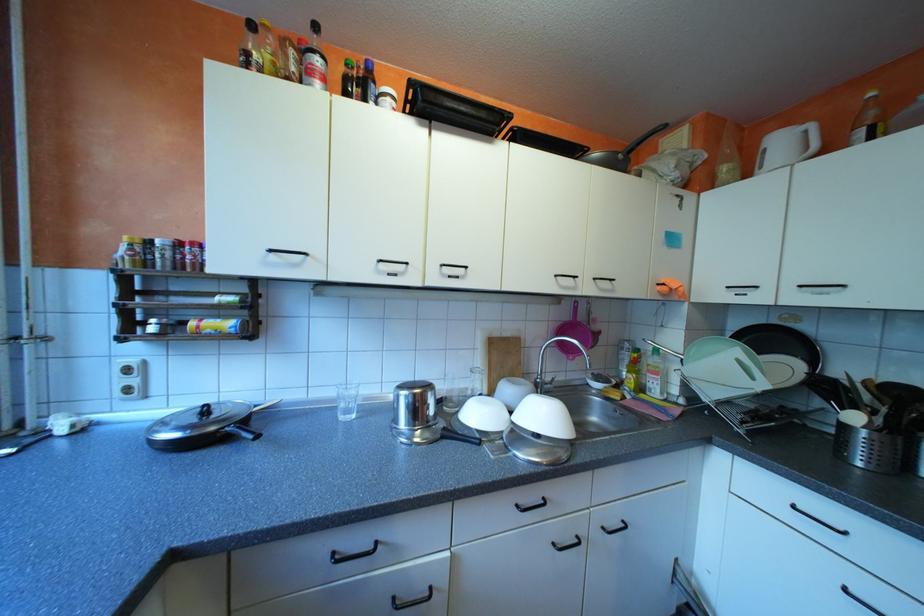
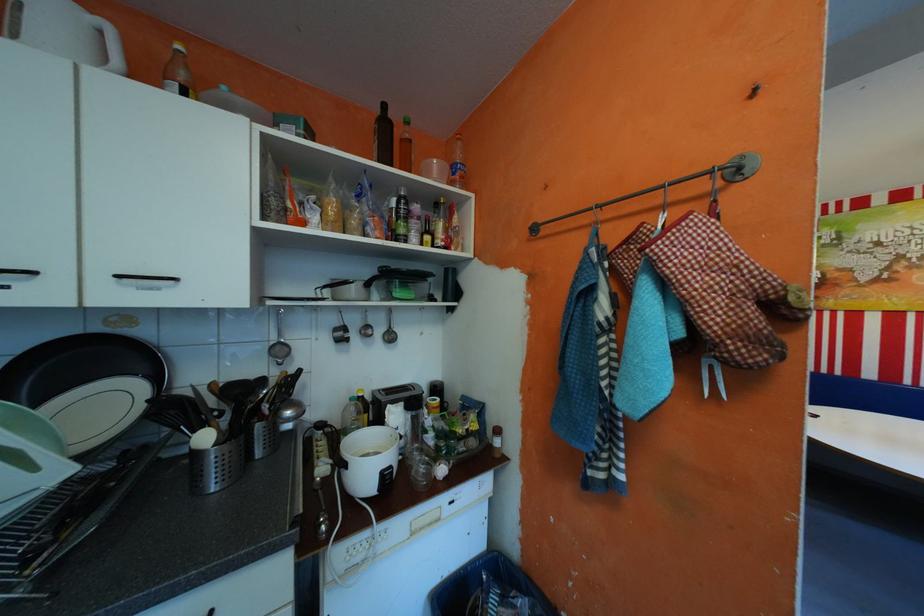
Question: Based on the continuous images, in which direction is the camera rotating? Reply with the corresponding letter.

Choices:
 (A) Left
 (B) Right
 (C) Up
 (D) Down

Answer: (B)